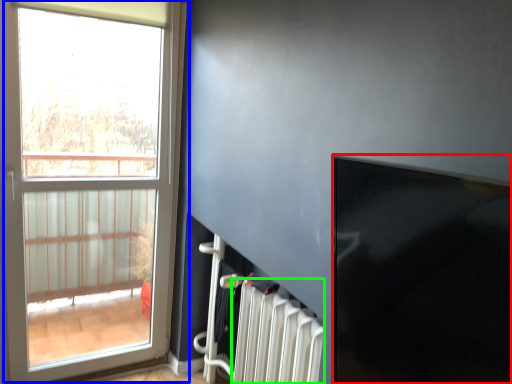
Question: Which object is positioned farthest from window screen (highlighted by a red box)? Select from window (highlighted by a blue box) and radiator (highlighted by a green box).

Choices:
 (A) window
 (B) radiator

Answer: (A)